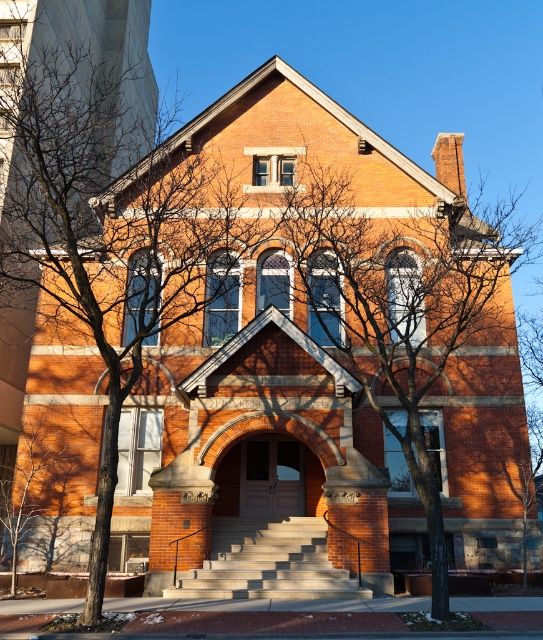
Question: Where is bare branches at center located in relation to light gray concrete stairs at center in the image?

Choices:
 (A) below
 (B) above

Answer: (B)

Question: Which of the following is the closest to the observer?

Choices:
 (A) light gray concrete stairs at center
 (B) bare branches at center

Answer: (B)

Question: Which point appears farthest from the camera in this image?

Choices:
 (A) (267, 564)
 (B) (349, 305)

Answer: (B)

Question: Is bare branches at center wider than light gray concrete stairs at center?

Choices:
 (A) yes
 (B) no

Answer: (A)

Question: Can you confirm if bare branches at center is positioned below light gray concrete stairs at center?

Choices:
 (A) yes
 (B) no

Answer: (B)